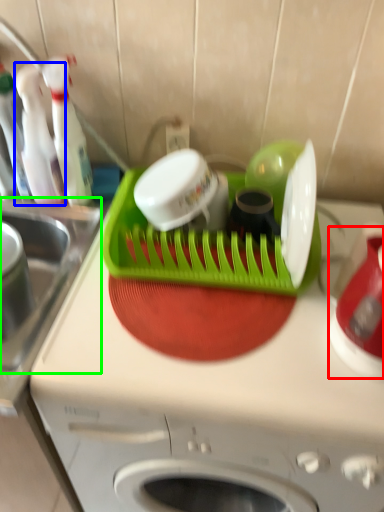
Question: Which object is the farthest from appliance (highlighted by a red box)? Choose among these: bottle (highlighted by a blue box) or sink (highlighted by a green box).

Choices:
 (A) bottle
 (B) sink

Answer: (A)